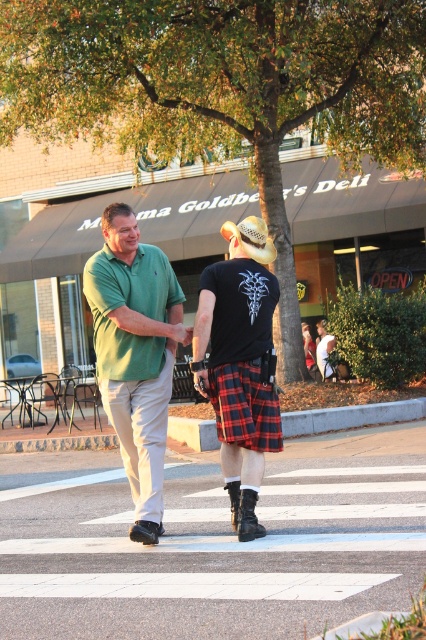
Who is positioned more to the left, green cotton polo shirt at center or plaid fabric at center?

From the viewer's perspective, green cotton polo shirt at center appears more on the left side.

Who is lower down, green cotton polo shirt at center or plaid fabric at center?

plaid fabric at center is below.

Where is `green cotton polo shirt at center`? This screenshot has width=426, height=640. green cotton polo shirt at center is located at coordinates (135, 353).

Locate an element on the screen. The width and height of the screenshot is (426, 640). green cotton polo shirt at center is located at coordinates (135, 353).

Is green cotton polo shirt at center further to camera compared to red plaid kilt at center?

No.

Is green cotton polo shirt at center shorter than red plaid kilt at center?

In fact, green cotton polo shirt at center may be taller than red plaid kilt at center.

You are a GUI agent. You are given a task and a screenshot of the screen. Output one action in this format:
    pyautogui.click(x=<x>, y=<y>)
    Task: Click on the green cotton polo shirt at center
    The image size is (426, 640).
    Given the screenshot: What is the action you would take?
    pyautogui.click(x=135, y=353)

Does plaid fabric at center have a lesser width compared to tan straw cowboy hat at center?

Incorrect, plaid fabric at center's width is not less than tan straw cowboy hat at center's.

Who is lower down, plaid fabric at center or tan straw cowboy hat at center?

plaid fabric at center is below.

Between point (261, 236) and point (273, 259), which one is positioned in front?

Point (261, 236)

This screenshot has width=426, height=640. In order to click on plaid fabric at center in this screenshot , I will do `click(239, 364)`.